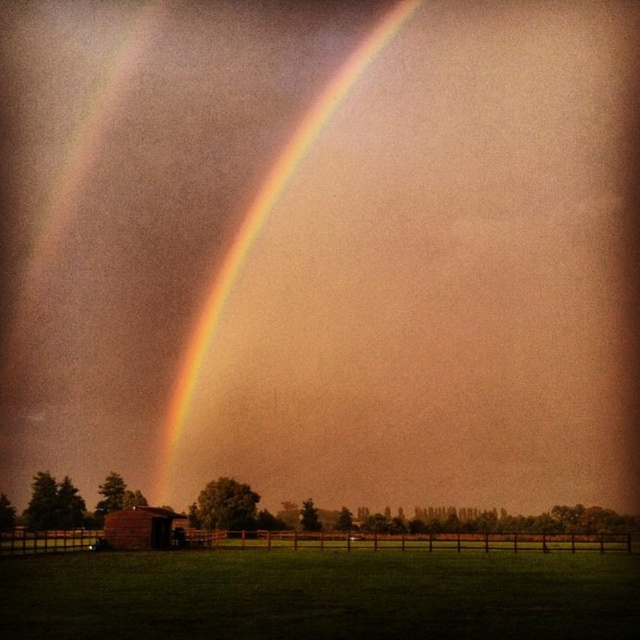
Question: Based on their relative distances, which object is farther from the rainbow at upper center?

Choices:
 (A) green grass at lower center
 (B) brown brick barn at lower left

Answer: (A)

Question: Among these objects, which one is farthest from the camera?

Choices:
 (A) rainbow at upper center
 (B) green grass at lower center

Answer: (A)

Question: Which object is positioned closest to the brown brick barn at lower left?

Choices:
 (A) rainbow at upper center
 (B) green grass at lower center

Answer: (B)

Question: Does green grass at lower center have a smaller size compared to brown brick barn at lower left?

Choices:
 (A) no
 (B) yes

Answer: (A)

Question: Is rainbow at upper center in front of brown brick barn at lower left?

Choices:
 (A) yes
 (B) no

Answer: (B)

Question: Is rainbow at upper center to the right of brown brick barn at lower left from the viewer's perspective?

Choices:
 (A) yes
 (B) no

Answer: (A)